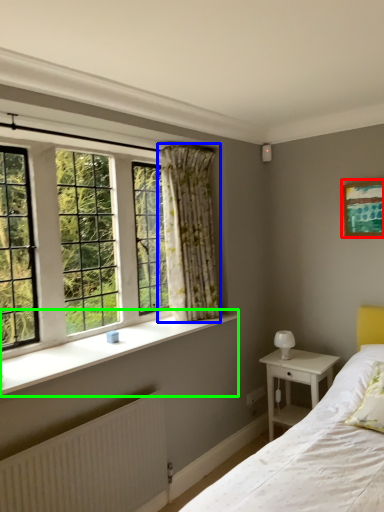
Question: Estimate the real-world distances between objects in this image. Which object is closer to picture frame (highlighted by a red box), curtain (highlighted by a blue box) or window sill (highlighted by a green box)?

Choices:
 (A) curtain
 (B) window sill

Answer: (A)